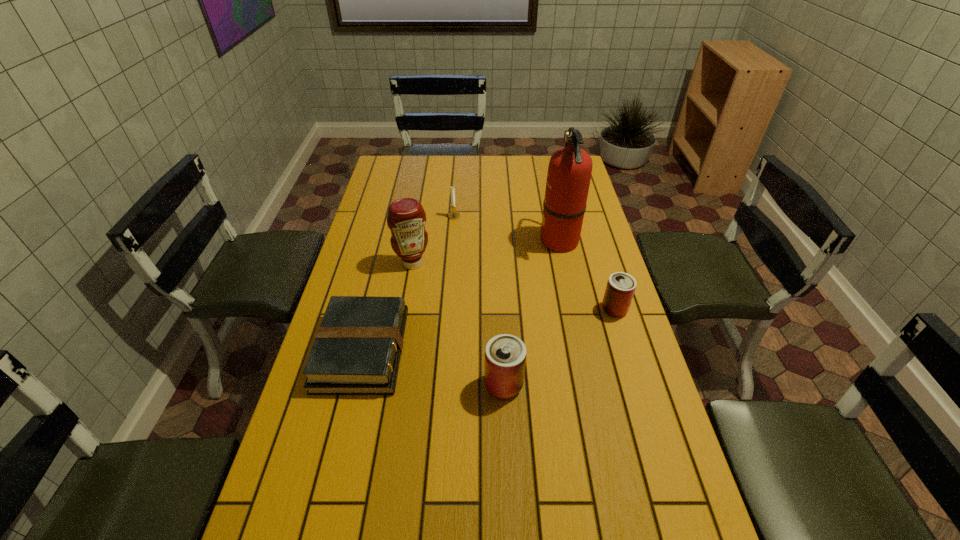
Locate an element on the screen. The width and height of the screenshot is (960, 540). free space located on the left of the left can is located at coordinates (450, 385).

The height and width of the screenshot is (540, 960). I want to click on free space located on the back of the rightmost object, so click(592, 235).

The image size is (960, 540). What are the coordinates of `free space located 0.270m on the front of the candle holder` in the screenshot? It's located at (450, 266).

Identify the location of blank space located on the side of the tallest object with the nozzle and handle. point(509,240).

Locate an element on the screen. The image size is (960, 540). vacant space located 0.120m on the side of the tallest object with the nozzle and handle is located at coordinates [x=506, y=240].

Where is `vacant space located 0.380m on the side of the tallest object with the nozzle and handle`? The width and height of the screenshot is (960, 540). vacant space located 0.380m on the side of the tallest object with the nozzle and handle is located at coordinates (435, 240).

Locate an element on the screen. The height and width of the screenshot is (540, 960). vacant space situated 0.330m on the back of the second tallest object is located at coordinates (423, 202).

Image resolution: width=960 pixels, height=540 pixels. In order to click on blank space located 0.260m on the spine side of the shortest object in this screenshot , I will do `click(495, 350)`.

Image resolution: width=960 pixels, height=540 pixels. Find the location of `condiment positioned at the left edge`. condiment positioned at the left edge is located at coordinates (406, 218).

The image size is (960, 540). What are the coordinates of `hardback book that is at the left edge` in the screenshot? It's located at (357, 349).